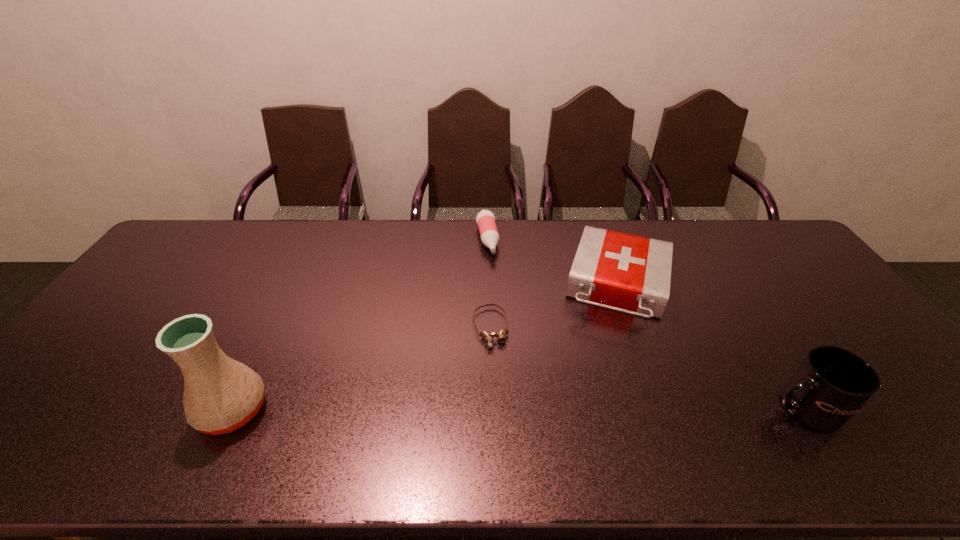
This screenshot has height=540, width=960. Identify the location of free space located 0.060m on the front lenses and sides of the shortest object. (498, 369).

You are a GUI agent. You are given a task and a screenshot of the screen. Output one action in this format:
    pyautogui.click(x=<x>, y=<y>)
    Task: Click on the first-aid kit that is at the far edge
    
    Given the screenshot: What is the action you would take?
    pyautogui.click(x=624, y=272)

What are the coordinates of `bottle situated at the far edge` in the screenshot? It's located at point(485,219).

What are the coordinates of `pottery that is at the near edge` in the screenshot? It's located at (221, 395).

Find the location of `mug that is at the near edge`. mug that is at the near edge is located at coordinates (831, 384).

Locate an element on the screen. The width and height of the screenshot is (960, 540). blank area at the far edge is located at coordinates (275, 241).

This screenshot has width=960, height=540. Find the location of `free space at the near edge of the desktop`. free space at the near edge of the desktop is located at coordinates (434, 393).

Locate an element on the screen. The width and height of the screenshot is (960, 540). free region at the left edge of the desktop is located at coordinates (83, 347).

You are a GUI agent. You are given a task and a screenshot of the screen. Output one action in this format:
    pyautogui.click(x=<x>, y=<y>)
    Task: Click on the free region at the right edge
    
    Given the screenshot: What is the action you would take?
    pyautogui.click(x=802, y=299)

Locate an element on the screen. The image size is (960, 540). free spot at the far right corner of the desktop is located at coordinates (733, 226).